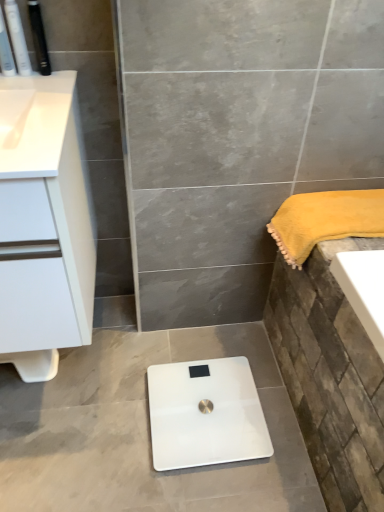
This screenshot has height=512, width=384. I want to click on free space above white glossy cabinet at upper left (from a real-world perspective), so click(x=41, y=106).